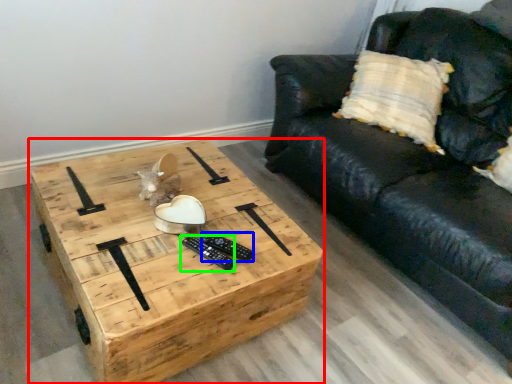
Question: Estimate the real-world distances between objects in this image. Which object is closer to coffee table (highlighted by a red box), remote (highlighted by a blue box) or remote (highlighted by a green box)?

Choices:
 (A) remote
 (B) remote

Answer: (B)